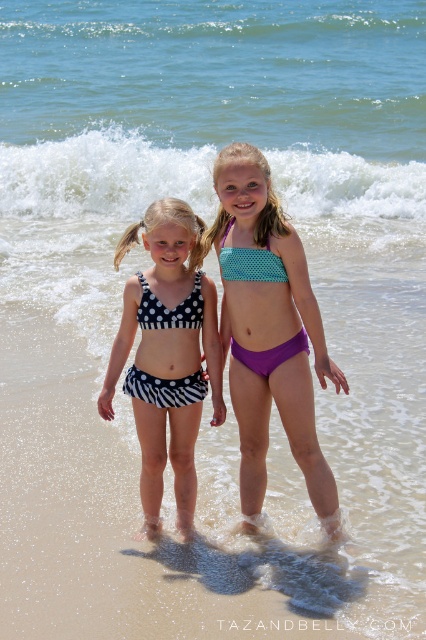
Question: Which object appears farthest from the camera in this image?

Choices:
 (A) teal polka dot bikini top at center
 (B) black polka dot bikini at center
 (C) teal polka dot bikini at center
 (D) white polka dot fabric bikini at center

Answer: (B)

Question: Can you confirm if teal polka dot bikini top at center is bigger than teal polka dot bikini at center?

Choices:
 (A) no
 (B) yes

Answer: (B)

Question: Does white polka dot fabric bikini at center appear on the left side of teal polka dot bikini at center?

Choices:
 (A) no
 (B) yes

Answer: (B)

Question: Which point is farther from the camera taking this photo?

Choices:
 (A) (296, 342)
 (B) (316, 340)

Answer: (A)

Question: Which point appears closest to the camera in this image?

Choices:
 (A) (123, 356)
 (B) (298, 454)

Answer: (B)

Question: Considering the relative positions of white polka dot fabric bikini at center and black polka dot bikini at center in the image provided, where is white polka dot fabric bikini at center located with respect to black polka dot bikini at center?

Choices:
 (A) left
 (B) right

Answer: (A)